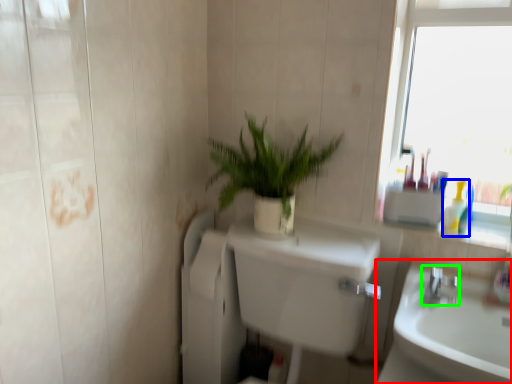
Question: Which object is positioned farthest from sink (highlighted by a red box)? Select from toiletry (highlighted by a blue box) and tap (highlighted by a green box).

Choices:
 (A) toiletry
 (B) tap

Answer: (A)